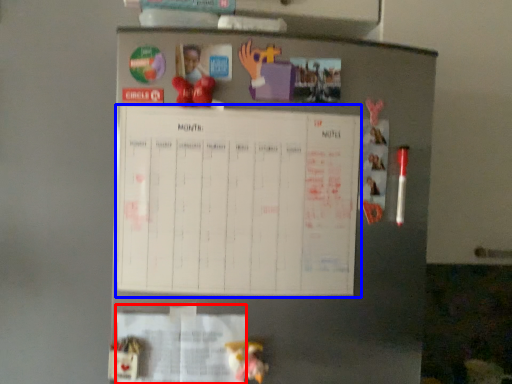
Question: Which object is closer to the camera taking this photo, paper (highlighted by a red box) or bulletin board (highlighted by a blue box)?

Choices:
 (A) paper
 (B) bulletin board

Answer: (B)